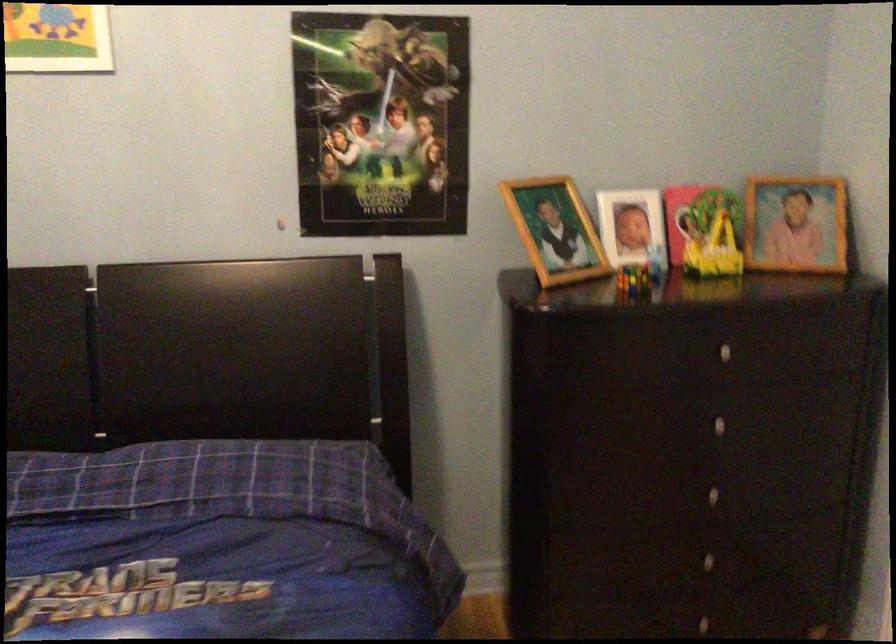
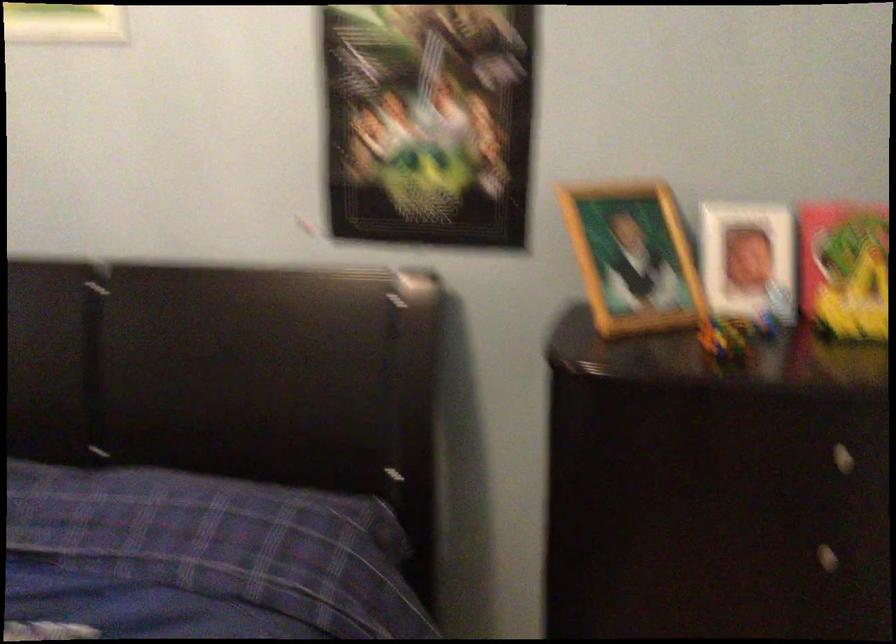
In the second image, find the point that corresponds to pixel 634 228 in the first image.

(748, 261)